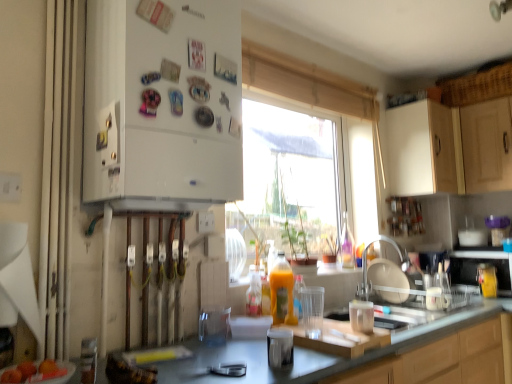
Question: Is metallic silver microwave at right, acting as the second appliance starting from the front, smaller than translucent plastic bottle at center?

Choices:
 (A) yes
 (B) no

Answer: (B)

Question: Is metallic silver microwave at right, which is counted as the first appliance, starting from the right, shorter than translucent plastic bottle at center?

Choices:
 (A) yes
 (B) no

Answer: (A)

Question: From the image's perspective, is metallic silver microwave at right, which is counted as the first appliance, starting from the right, located beneath translucent plastic bottle at center?

Choices:
 (A) no
 (B) yes

Answer: (B)

Question: Is metallic silver microwave at right, which is the 1th appliance from back to front, to the right of translucent plastic bottle at center from the viewer's perspective?

Choices:
 (A) no
 (B) yes

Answer: (B)

Question: From the image's perspective, is metallic silver microwave at right, which is the 2th appliance in left-to-right order, located above translucent plastic bottle at center?

Choices:
 (A) no
 (B) yes

Answer: (A)

Question: Considering the positions of point (386, 259) and point (208, 79), is point (386, 259) closer or farther from the camera than point (208, 79)?

Choices:
 (A) closer
 (B) farther

Answer: (B)

Question: In terms of size, does satin nickel faucet at sink right appear bigger or smaller than white matte refrigerator at left, the 1th cabinetry in the front-to-back sequence?

Choices:
 (A) small
 (B) big

Answer: (A)

Question: Considering the relative positions of satin nickel faucet at sink right and white matte refrigerator at left, the second cabinetry from the back, in the image provided, is satin nickel faucet at sink right to the left or to the right of white matte refrigerator at left, the second cabinetry from the back,?

Choices:
 (A) left
 (B) right

Answer: (B)

Question: Considering their positions, is satin nickel faucet at sink right located in front of or behind white matte refrigerator at left, placed as the second cabinetry when sorted from right to left?

Choices:
 (A) front
 (B) behind

Answer: (B)

Question: From a real-world perspective, relative to smooth orange fruit at lower left, is white matte refrigerator at left, the 1th cabinetry in the front-to-back sequence, vertically above or below?

Choices:
 (A) below
 (B) above

Answer: (B)

Question: Looking at the image, does white matte refrigerator at left, the 1th cabinetry in the front-to-back sequence, seem bigger or smaller compared to smooth orange fruit at lower left?

Choices:
 (A) big
 (B) small

Answer: (A)

Question: In the image, is white matte refrigerator at left, the 1th cabinetry in the front-to-back sequence, positioned in front of or behind smooth orange fruit at lower left?

Choices:
 (A) behind
 (B) front

Answer: (A)

Question: Based on their positions, is white matte refrigerator at left, placed as the second cabinetry when sorted from right to left, located to the left or right of smooth orange fruit at lower left?

Choices:
 (A) right
 (B) left

Answer: (A)

Question: Looking at the image, does white matte cabinet at upper right, which ranks as the 2th cabinetry in front-to-back order, seem bigger or smaller compared to white fabric curtain at left?

Choices:
 (A) big
 (B) small

Answer: (A)

Question: Does point (421, 147) appear closer or farther from the camera than point (73, 109)?

Choices:
 (A) farther
 (B) closer

Answer: (A)